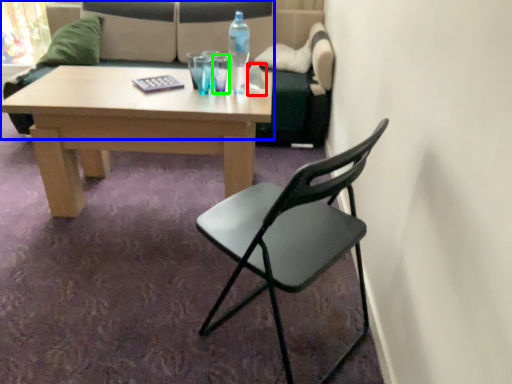
Question: Which object is the closest to the towel/napkin (highlighted by a red box)? Choose among these: studio couch (highlighted by a blue box) or coffee cup (highlighted by a green box).

Choices:
 (A) studio couch
 (B) coffee cup

Answer: (B)